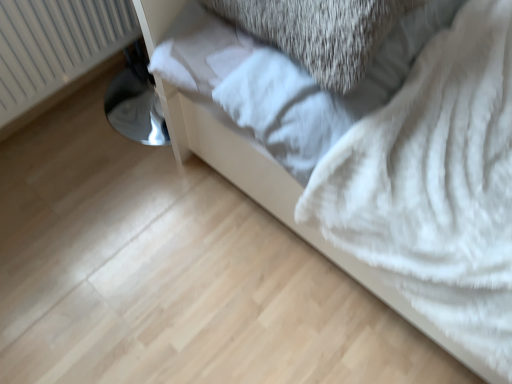
Question: Is white plastic radiator at left wider or thinner than white fluffy blanket at lower right?

Choices:
 (A) thin
 (B) wide

Answer: (A)

Question: In terms of size, does white plastic radiator at left appear bigger or smaller than white fluffy blanket at lower right?

Choices:
 (A) small
 (B) big

Answer: (A)

Question: Based on their relative distances, which object is nearer to the white plastic radiator at left?

Choices:
 (A) white fluffy blanket at lower right
 (B) white fluffy sheet at center

Answer: (A)

Question: Estimate the real-world distances between objects in this image. Which object is closer to the white fluffy sheet at center?

Choices:
 (A) white plastic radiator at left
 (B) white fluffy blanket at lower right

Answer: (B)